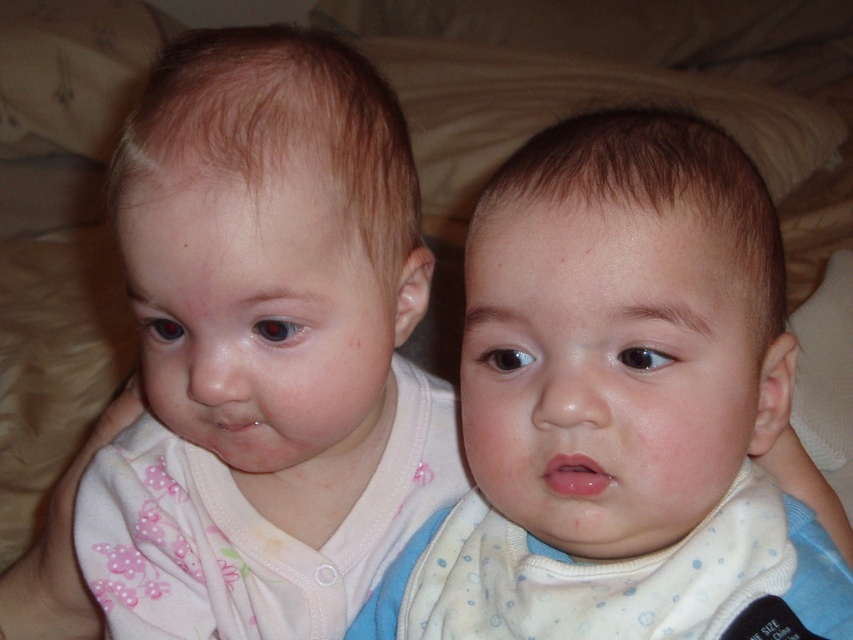
Can you confirm if pink fabric face at left is smaller than pink fabric bib at center?

No, pink fabric face at left is not smaller than pink fabric bib at center.

The height and width of the screenshot is (640, 853). Identify the location of pink fabric face at left. (258, 317).

Does smooth skin baby at center come behind pink fabric bib at center?

No, it is not.

Is smooth skin baby at center above pink fabric bib at center?

Yes, smooth skin baby at center is above pink fabric bib at center.

The width and height of the screenshot is (853, 640). In order to click on smooth skin baby at center in this screenshot , I will do `click(608, 371)`.

Is point (531, 545) more distant than point (122, 580)?

No, it is in front of (122, 580).

This screenshot has width=853, height=640. Identify the location of white soft bib at center. (619, 406).